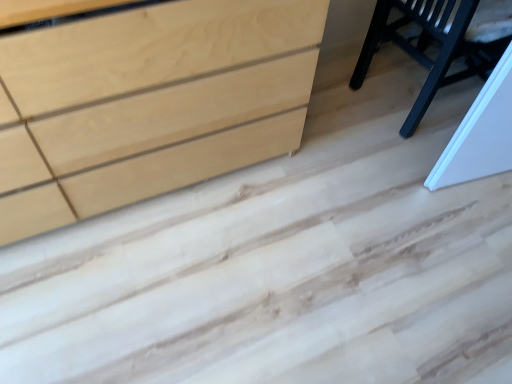
Where is `free space in front of natural wood chest of drawers at lower left`? The height and width of the screenshot is (384, 512). free space in front of natural wood chest of drawers at lower left is located at coordinates (147, 291).